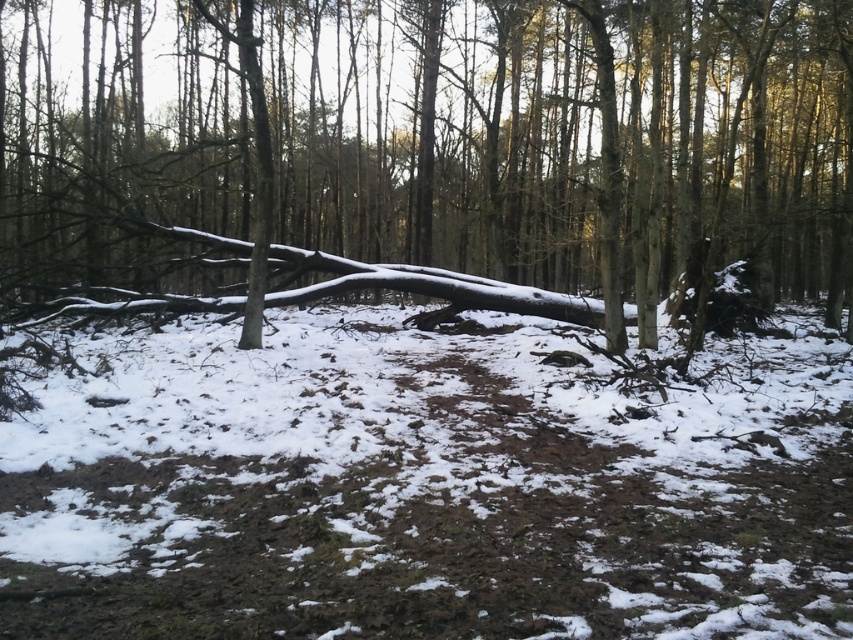
Question: Which point is farther to the camera?

Choices:
 (A) (347, 458)
 (B) (16, 198)

Answer: (B)

Question: Is snow-covered log at center bigger than white powdery snow at center?

Choices:
 (A) no
 (B) yes

Answer: (B)

Question: Is snow-covered log at center behind white powdery snow at center?

Choices:
 (A) no
 (B) yes

Answer: (B)

Question: Does snow-covered log at center appear on the left side of white powdery snow at center?

Choices:
 (A) yes
 (B) no

Answer: (A)

Question: Which of the following is the closest to the observer?

Choices:
 (A) snow-covered log at center
 (B) white powdery snow at center

Answer: (B)